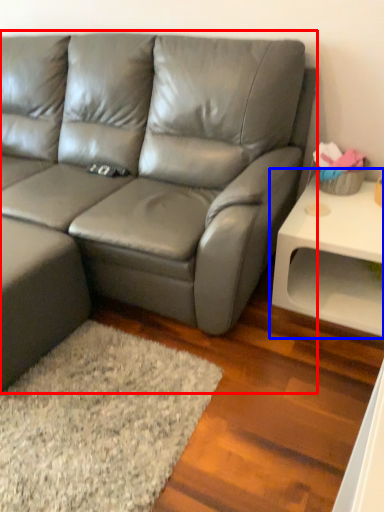
Question: Which of the following is the farthest to the observer, studio couch (highlighted by a red box) or table (highlighted by a blue box)?

Choices:
 (A) studio couch
 (B) table

Answer: (B)